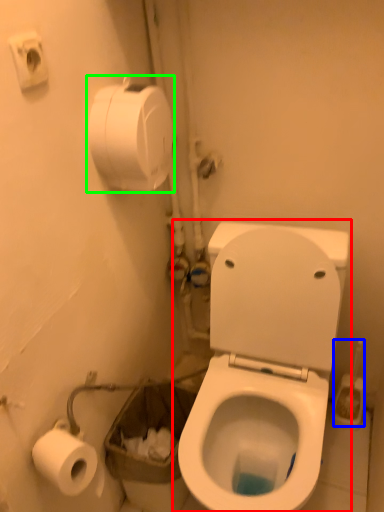
Question: Estimate the real-world distances between objects in this image. Which object is farther from toilet (highlighted by a red box), brush (highlighted by a blue box) or toilet paper (highlighted by a green box)?

Choices:
 (A) brush
 (B) toilet paper

Answer: (B)